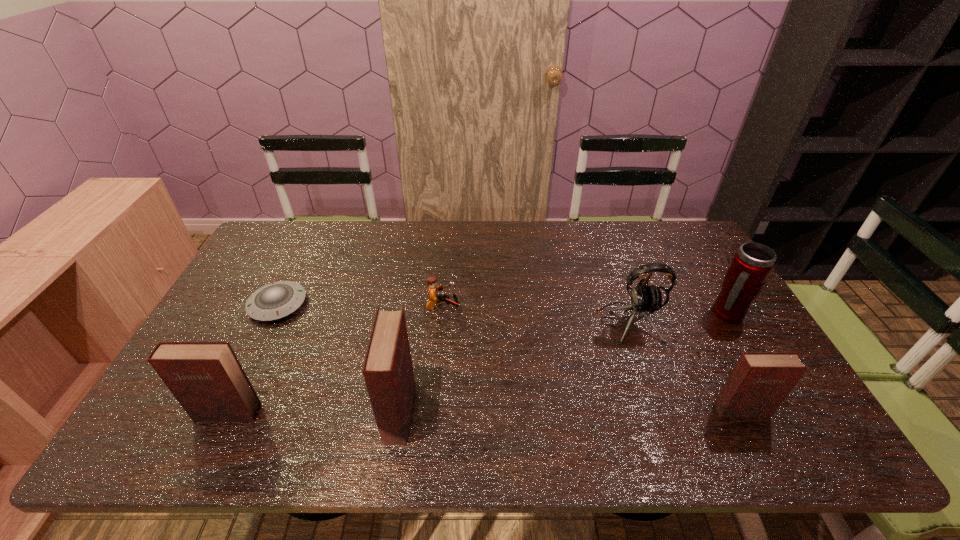
Identify the location of free space between the rightmost diary and the leftmost diary. (485, 411).

Where is `vacant area that lies between the second diary from right to left and the fourth object from right to left`? This screenshot has width=960, height=540. vacant area that lies between the second diary from right to left and the fourth object from right to left is located at coordinates (421, 360).

Where is `free spot between the leftmost diary and the Lego`? The width and height of the screenshot is (960, 540). free spot between the leftmost diary and the Lego is located at coordinates (335, 361).

Image resolution: width=960 pixels, height=540 pixels. Identify the location of empty location between the second shortest diary and the fourth object from left to right. (335, 361).

You are a GUI agent. You are given a task and a screenshot of the screen. Output one action in this format:
    pyautogui.click(x=<x>, y=<y>)
    Task: Click on the free point between the thermos bottle and the earphone
    The image size is (960, 540).
    Given the screenshot: What is the action you would take?
    pyautogui.click(x=678, y=319)

The width and height of the screenshot is (960, 540). Find the location of `empty space between the fourth object from left to right and the second diary from right to left`. empty space between the fourth object from left to right and the second diary from right to left is located at coordinates (421, 360).

This screenshot has width=960, height=540. What are the coordinates of `object that can be found as the closest to the thermos bottle` in the screenshot? It's located at (644, 299).

The width and height of the screenshot is (960, 540). What are the coordinates of `the sixth closest object relative to the second tallest diary` in the screenshot? It's located at [x=752, y=264].

Locate which diary ranks in proximity to the fifth tallest object. Please provide its 2D coordinates. Your answer should be formatted as a tuple, i.e. [(x, y)], where the tuple contains the x and y coordinates of a point satisfying the conditions above.

[(388, 371)]

Locate an element on the screen. diary that is the second closest to the thermos bottle is located at coordinates (388, 371).